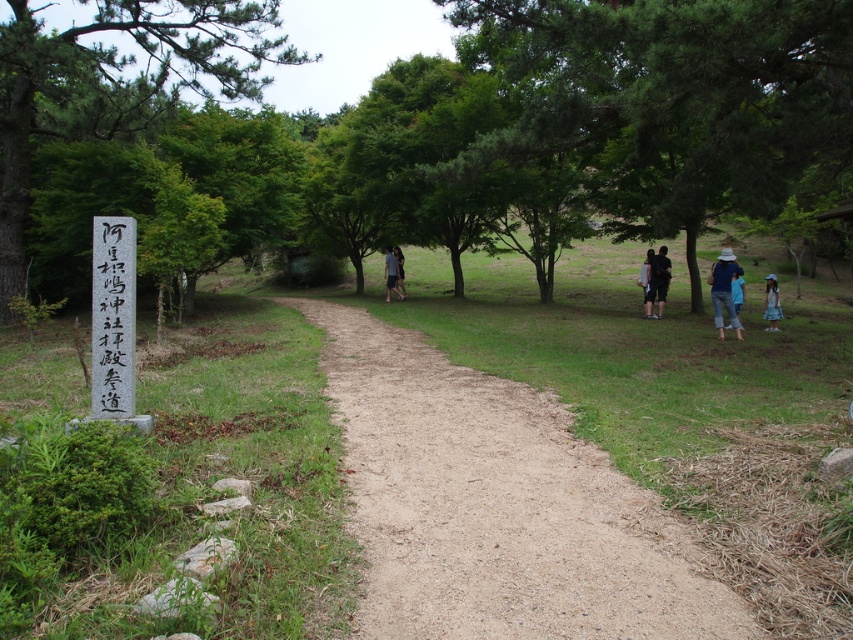
You are a hiker who has just found a white wood sign at left and a denim hat at right on the dirt path. Which object is smaller in size?

The white wood sign at left is smaller in size compared to the denim hat at right.

You are a hiker who wants to take a photo of both the green leafy tree at right and the green leafy tree at left in the same frame. Which tree should you stand closer to in order to include both in your photo?

You should stand closer to the green leafy tree at right because it is shorter than the green leafy tree at left, allowing you to capture both trees within the frame by adjusting your position accordingly.

In the scene shown: You are a hiker who wants to walk along the brown gravel path at center. However, you notice a green leafy tree at left. Which direction should you walk to stay on the path while avoiding the tree?

The brown gravel path at center is below the green leafy tree at left, so you should walk towards the direction away from the tree to stay on the path.